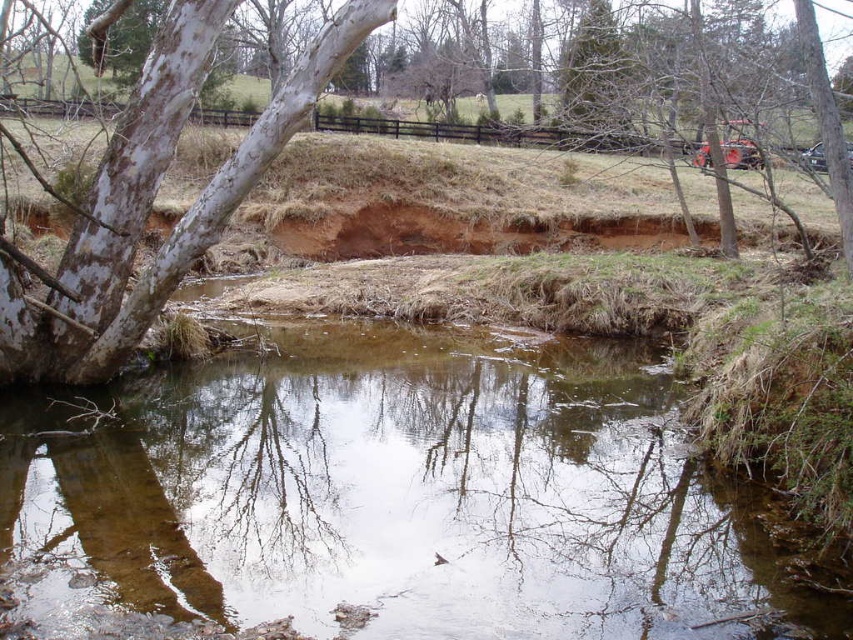
Question: Where is clear water at center located in relation to white smooth bark tree at upper left in the image?

Choices:
 (A) above
 (B) below

Answer: (B)

Question: Can you confirm if clear water at center is thinner than white smooth bark tree at upper left?

Choices:
 (A) yes
 (B) no

Answer: (B)

Question: Does clear water at center have a lesser width compared to white smooth bark tree at upper left?

Choices:
 (A) yes
 (B) no

Answer: (B)